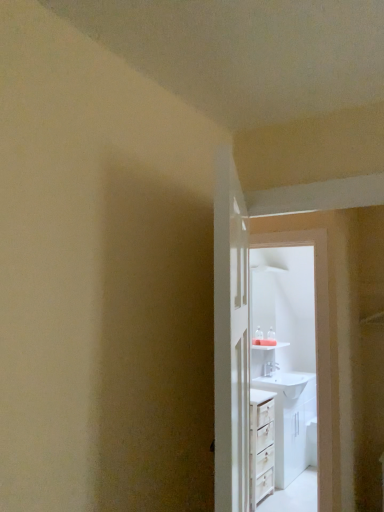
What is the approximate width of white glossy sink at upper center?

white glossy sink at upper center is 3.00 inches wide.

Measure the distance between point (x=222, y=349) and camera.

Point (x=222, y=349) is 33.58 inches from camera.

What is the approximate height of white glossy door at center?

white glossy door at center is 3.68 feet in height.

Describe the element at coordinates (292, 422) in the screenshot. The height and width of the screenshot is (512, 384). I see `white glossy sink at center` at that location.

The height and width of the screenshot is (512, 384). Identify the location of white glossy sink at upper center. (316, 346).

Would you say white glossy door at center is a long distance from white glossy sink at upper center?

Yes.

How many degrees apart are the facing directions of white glossy door at center and white glossy sink at upper center?

They differ by 114 degrees in their facing directions.

Considering the positions of point (217, 268) and point (331, 402), is point (217, 268) closer or farther from the camera than point (331, 402)?

Point (217, 268) is positioned closer to the camera compared to point (331, 402).

Does white glossy sink at center contain white glossy door at center?

No, white glossy door at center is not inside white glossy sink at center.

Between white glossy sink at center and white glossy door at center, which one has smaller width?

white glossy door at center.

Locate an element on the screen. Image resolution: width=384 pixels, height=512 pixels. door that is above the white glossy sink at center (from the image's perspective) is located at coordinates (231, 339).

In the scene shown: Considering the relative sizes of white glossy sink at center and white glossy door at center in the image provided, is white glossy sink at center bigger than white glossy door at center?

Correct, white glossy sink at center is larger in size than white glossy door at center.

Considering the positions of objects white glossy sink at upper center and white glossy sink at center in the image provided, who is in front, white glossy sink at upper center or white glossy sink at center?

white glossy sink at upper center is more forward.

Could you tell me if white glossy sink at upper center is turned towards white glossy sink at center?

No, white glossy sink at upper center is not facing towards white glossy sink at center.

Looking at this image, from a real-world perspective, is white glossy sink at upper center below white glossy sink at center?

No, from a real-world perspective, white glossy sink at upper center is not beneath white glossy sink at center.

Between point (326, 476) and point (284, 473), which one is positioned in front?

Point (326, 476)

Is white glossy sink at center in front of or behind white glossy sink at upper center in the image?

Clearly, white glossy sink at center is behind white glossy sink at upper center.

Could you tell me if white glossy sink at center is turned towards white glossy sink at upper center?

No, white glossy sink at center is not facing towards white glossy sink at upper center.

Is point (295, 411) in front of point (299, 236)?

No.

Which object is thinner, white glossy sink at center or white glossy sink at upper center?

white glossy sink at upper center.

Which object is closer to the camera, white glossy door at center or white glossy sink at center?

white glossy door at center is in front.

Is white glossy door at center not inside white glossy sink at center?

Yes.

Is white glossy door at center to the left of white glossy sink at center from the viewer's perspective?

Indeed, white glossy door at center is positioned on the left side of white glossy sink at center.

Between white glossy door at center and white glossy sink at center, which one has smaller size?

white glossy door at center is smaller.

This screenshot has height=512, width=384. In order to click on screen door behind the white glossy door at center in this screenshot , I will do tap(316, 346).

Is white glossy sink at upper center positioned far away from white glossy door at center?

Indeed, white glossy sink at upper center is not near white glossy door at center.

Could white glossy door at center be considered to be inside white glossy sink at upper center?

That's incorrect, white glossy door at center is not inside white glossy sink at upper center.

Which is more to the left, white glossy sink at upper center or white glossy door at center?

white glossy door at center.

Find the location of `screen door behind the white glossy door at center`. screen door behind the white glossy door at center is located at coordinates (316, 346).

This screenshot has width=384, height=512. I want to click on sink located underneath the white glossy door at center (from a real-world perspective), so click(x=292, y=422).

Based on their spatial positions, is white glossy sink at upper center or white glossy door at center closer to white glossy sink at center?

white glossy sink at upper center is positioned closer to the anchor white glossy sink at center.

Based on their spatial positions, is white glossy door at center or white glossy sink at center further from white glossy sink at upper center?

white glossy sink at center is positioned further to the anchor white glossy sink at upper center.

From the image, which object appears to be farther from white glossy sink at center, white glossy door at center or white glossy sink at upper center?

Based on the image, white glossy door at center appears to be further to white glossy sink at center.

Considering their positions, is white glossy sink at center positioned further to white glossy sink at upper center than white glossy door at center?

The object further to white glossy sink at upper center is white glossy sink at center.

Considering their positions, is white glossy sink at upper center positioned further to white glossy door at center than white glossy sink at center?

white glossy sink at center is further to white glossy door at center.

When comparing their distances from white glossy door at center, does white glossy sink at center or white glossy sink at upper center seem further?

white glossy sink at center lies further to white glossy door at center than the other object.

Identify the location of screen door between white glossy door at center and white glossy sink at center along the z-axis. This screenshot has width=384, height=512. (316, 346).